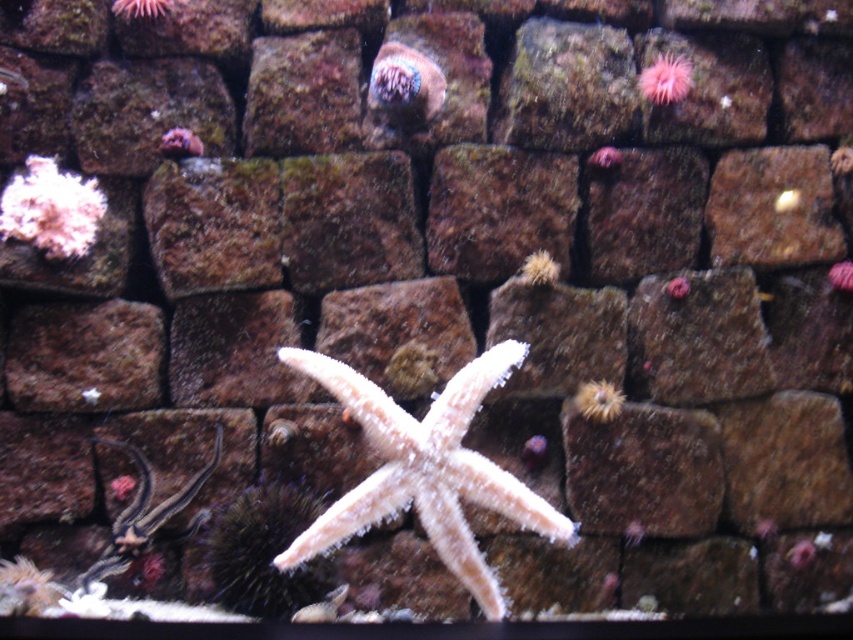
In the scene shown: Which of these two, fuzzy orange sea anemone at center-right or smooth purple starfish at upper left, stands taller?

fuzzy orange sea anemone at center-right is taller.

The height and width of the screenshot is (640, 853). What do you see at coordinates (598, 401) in the screenshot?
I see `fuzzy orange sea anemone at center-right` at bounding box center [598, 401].

What do you see at coordinates (598, 401) in the screenshot? The width and height of the screenshot is (853, 640). I see `fuzzy orange sea anemone at center-right` at bounding box center [598, 401].

At what (x,y) coordinates should I click in order to perform the action: click on fuzzy orange sea anemone at center-right. Please return your answer as a coordinate pair (x, y). Image resolution: width=853 pixels, height=640 pixels. Looking at the image, I should click on (x=598, y=401).

Is shiny blue coral at upper center closer to the viewer compared to pink fuzzy anemone at upper right?

Yes.

Describe the element at coordinates (405, 83) in the screenshot. I see `shiny blue coral at upper center` at that location.

Who is more forward, (419, 92) or (663, 65)?

Point (419, 92)

This screenshot has width=853, height=640. I want to click on shiny blue coral at upper center, so click(405, 83).

Does fuzzy orange sea anemone at center-right have a lesser height compared to pink coral at center?

No.

Can you confirm if fuzzy orange sea anemone at center-right is positioned above pink coral at center?

No, fuzzy orange sea anemone at center-right is not above pink coral at center.

Describe the element at coordinates (598, 401) in the screenshot. I see `fuzzy orange sea anemone at center-right` at that location.

Identify the location of fuzzy orange sea anemone at center-right. This screenshot has width=853, height=640. (598, 401).